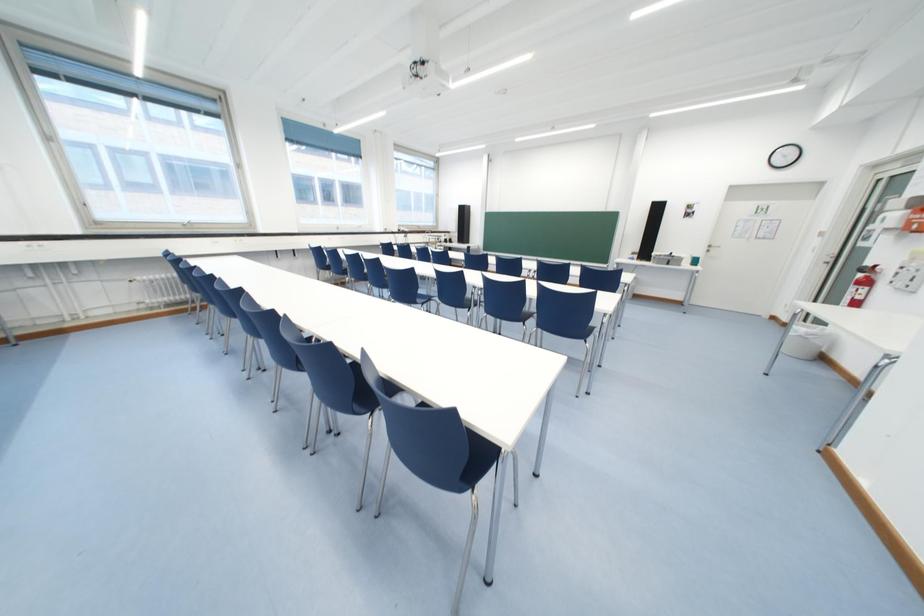
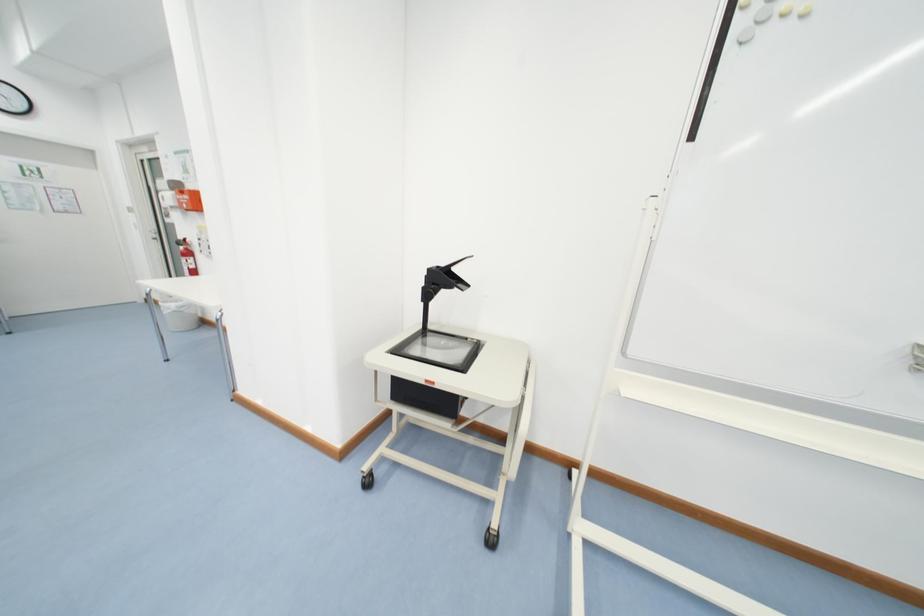
In the scene shown: The images are taken continuously from a first-person perspective. In which direction is your viewpoint rotating?

The rotation direction of the camera is right-down.